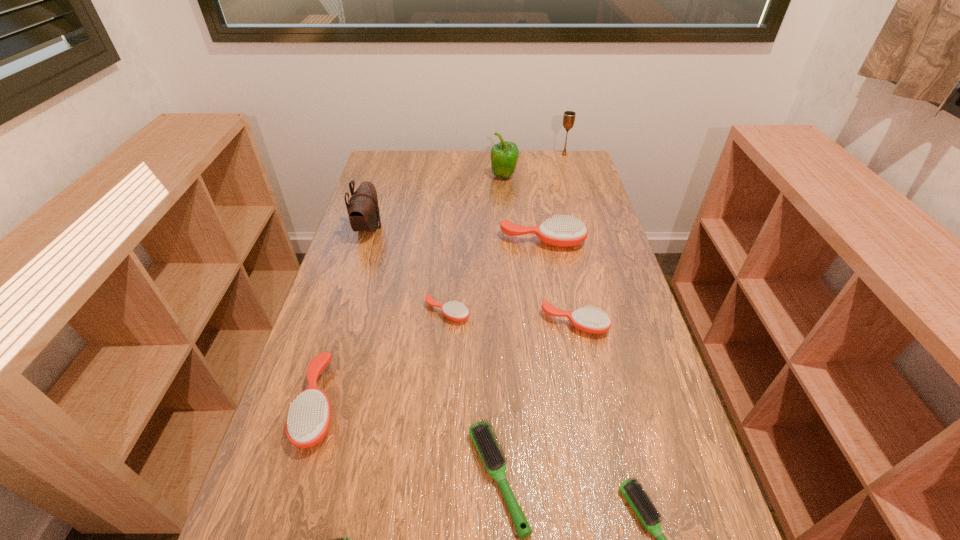
Find the location of `the second orange hairbrush from left to right`. the second orange hairbrush from left to right is located at coordinates (456, 311).

Locate an element on the screen. the fourth object from left to right is located at coordinates (456, 311).

The image size is (960, 540). What are the coordinates of `vacant space located 0.110m on the left of the chalice` in the screenshot? It's located at (532, 154).

You are a GUI agent. You are given a task and a screenshot of the screen. Output one action in this format:
    pyautogui.click(x=<x>, y=<y>)
    Task: Click on the vacant space located on the left of the green bell pepper
    The image size is (960, 540).
    Given the screenshot: What is the action you would take?
    pyautogui.click(x=471, y=176)

Locate an element on the screen. vacant space located 0.190m with the flap open on the pouch is located at coordinates (441, 228).

Find the location of a particular element. vacant space situated on the left of the farthest hairbrush is located at coordinates (411, 241).

Find the location of a particular element. The width and height of the screenshot is (960, 540). vacant region located 0.060m on the front of the second biggest orange hairbrush is located at coordinates (295, 485).

What are the coordinates of `free space located 0.290m on the front of the second smallest orange hairbrush` in the screenshot? It's located at (602, 451).

Identify the location of vacant space located on the right of the seventh object from right to left. (561, 312).

I want to click on chalice at the far edge, so click(569, 116).